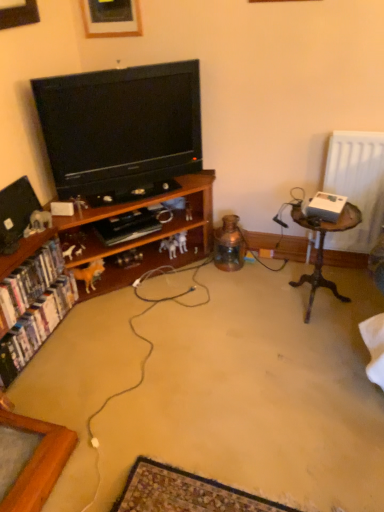
Question: From a real-world perspective, is wooden picture frame at upper center under white glossy bookshelf at left, the 1th book from the top?

Choices:
 (A) no
 (B) yes

Answer: (A)

Question: Is wooden picture frame at upper center oriented towards white glossy bookshelf at left, acting as the second book starting from the bottom?

Choices:
 (A) yes
 (B) no

Answer: (B)

Question: Considering the relative sizes of wooden picture frame at upper center and white glossy bookshelf at left, the 1th book from the top, in the image provided, is wooden picture frame at upper center shorter than white glossy bookshelf at left, the 1th book from the top,?

Choices:
 (A) no
 (B) yes

Answer: (A)

Question: Can you confirm if wooden picture frame at upper center is positioned to the right of white glossy bookshelf at left, acting as the second book starting from the bottom?

Choices:
 (A) no
 (B) yes

Answer: (B)

Question: From a real-world perspective, is wooden picture frame at upper center located higher than white glossy bookshelf at left, acting as the second book starting from the bottom?

Choices:
 (A) no
 (B) yes

Answer: (B)

Question: Is the position of wooden picture frame at upper center less distant than that of white glossy bookshelf at left, the 1th book from the top?

Choices:
 (A) yes
 (B) no

Answer: (B)

Question: Is matte black television at left, positioned as the 1th television in left-to-right order, wider than white glossy bookshelf at lower left, the first book in the bottom-to-top sequence?

Choices:
 (A) no
 (B) yes

Answer: (A)

Question: From the image's perspective, is matte black television at left, the second television from the right, beneath white glossy bookshelf at lower left, which is the second book in top-to-bottom order?

Choices:
 (A) no
 (B) yes

Answer: (A)

Question: Would you say matte black television at left, positioned as the 1th television in left-to-right order, is a long distance from white glossy bookshelf at lower left, which is the second book in top-to-bottom order?

Choices:
 (A) yes
 (B) no

Answer: (B)

Question: Is matte black television at left, positioned as the 1th television in left-to-right order, positioned beyond the bounds of white glossy bookshelf at lower left, which is the second book in top-to-bottom order?

Choices:
 (A) yes
 (B) no

Answer: (A)

Question: Is matte black television at left, the second television from the right, surrounding white glossy bookshelf at lower left, the first book in the bottom-to-top sequence?

Choices:
 (A) no
 (B) yes

Answer: (A)

Question: From a real-world perspective, is matte black television at left, positioned as the 1th television in left-to-right order, below white glossy bookshelf at lower left, which is the second book in top-to-bottom order?

Choices:
 (A) yes
 (B) no

Answer: (B)

Question: Is wooden cabinet at left surrounded by wooden picture frame at upper center?

Choices:
 (A) no
 (B) yes

Answer: (A)